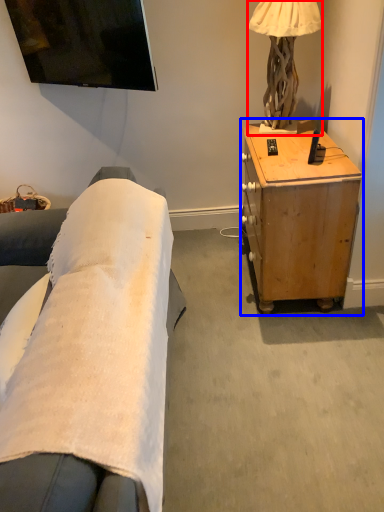
Question: Which point is further to the camera, lamp (highlighted by a red box) or desk (highlighted by a blue box)?

Choices:
 (A) lamp
 (B) desk

Answer: (A)